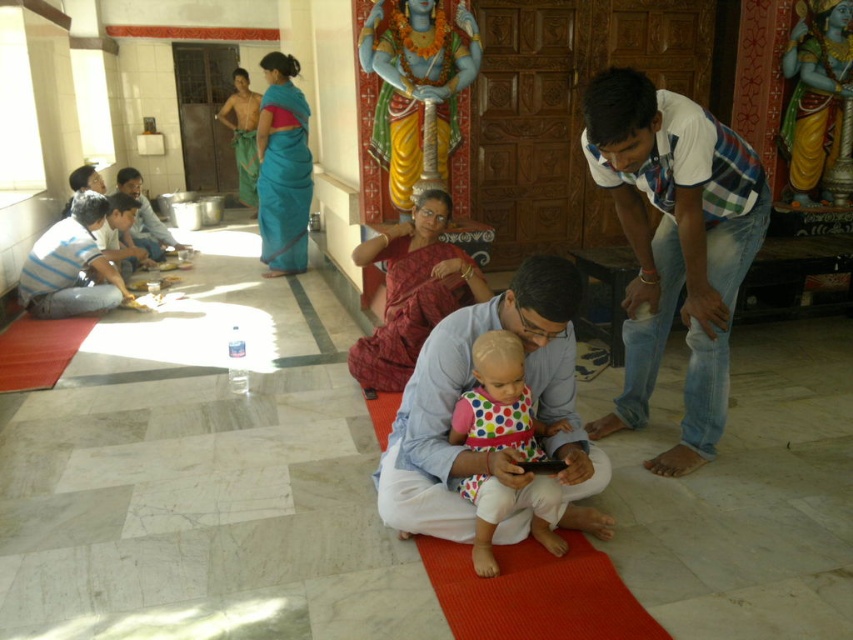
Which is behind, point (427, 241) or point (474, 387)?

The point (427, 241) is behind.

Is red silk saree at center positioned before polka dot fabric dress at center?

No, it is not.

Is point (444, 241) in front of point (485, 342)?

No, (444, 241) is further to viewer.

Where is `red silk saree at center`? The width and height of the screenshot is (853, 640). red silk saree at center is located at coordinates (412, 291).

Find the location of a particular element. The height and width of the screenshot is (640, 853). teal silk saree at upper center is located at coordinates (282, 168).

Which of these two, teal silk saree at upper center or teal silk saree at center, stands shorter?

teal silk saree at upper center is shorter.

Image resolution: width=853 pixels, height=640 pixels. Find the location of `teal silk saree at upper center`. teal silk saree at upper center is located at coordinates (282, 168).

Is point (711, 410) more distant than point (125, 301)?

No, (711, 410) is in front of (125, 301).

Where is `white cotton shirt at right`? white cotton shirt at right is located at coordinates 674,244.